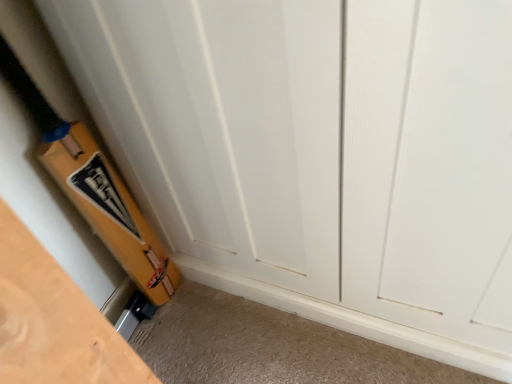
Locate an element on the screen. yellow matte baseball bat at lower left is located at coordinates (93, 187).

Describe the element at coordinates (93, 187) in the screenshot. I see `yellow matte baseball bat at lower left` at that location.

Measure the distance between yellow matte baseball bat at lower left and camera.

The depth of yellow matte baseball bat at lower left is 28.71 inches.

Where is `yellow matte baseball bat at lower left`? yellow matte baseball bat at lower left is located at coordinates (93, 187).